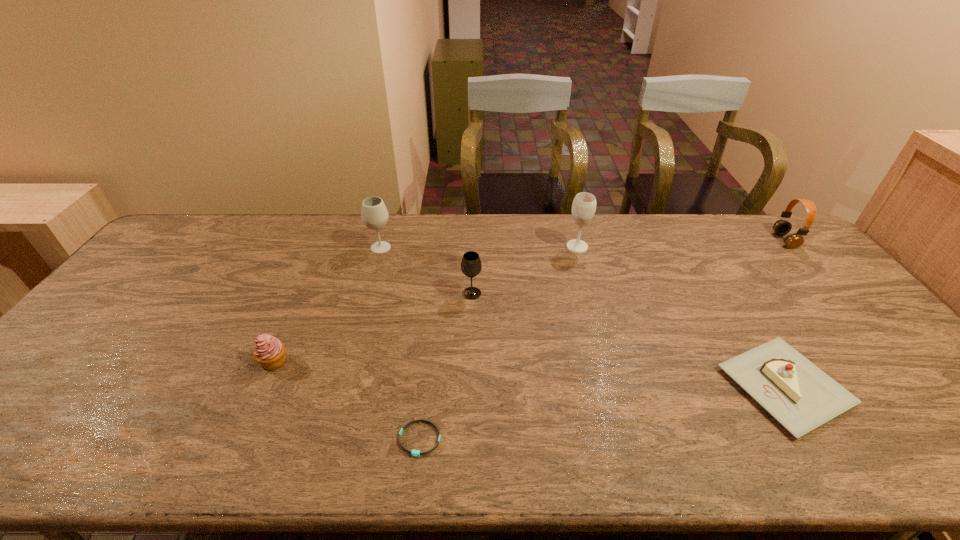
The height and width of the screenshot is (540, 960). In order to click on the rightmost wineglass in this screenshot , I will do `click(584, 204)`.

Where is `the second object from left to right`? the second object from left to right is located at coordinates (374, 214).

Where is `the rightmost object`? Image resolution: width=960 pixels, height=540 pixels. the rightmost object is located at coordinates (782, 227).

Locate an element on the screen. This screenshot has height=540, width=960. the fourth nearest object is located at coordinates (471, 265).

Where is `the shortest wineglass`? the shortest wineglass is located at coordinates (471, 265).

Image resolution: width=960 pixels, height=540 pixels. Identify the location of the leftmost object. (269, 352).

Identify the location of cupcake. (269, 352).

You are a GUI agent. You are given a task and a screenshot of the screen. Output one action in this format:
    pyautogui.click(x=<x>, y=<y>)
    Task: Click on the second object from right to left
    
    Given the screenshot: What is the action you would take?
    pyautogui.click(x=800, y=396)

Identify the location of cake. (800, 396).

I want to click on the third object from left to right, so click(415, 453).